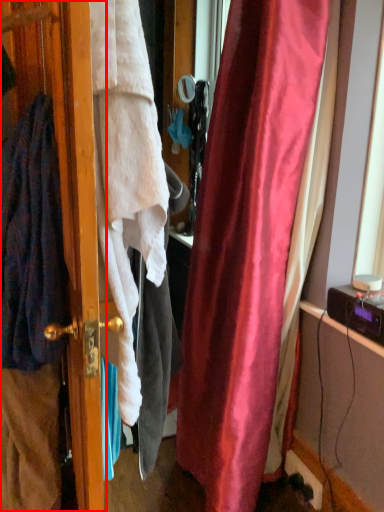
Question: From the image's perspective, what is the correct spatial relationship of screen door (annotated by the red box) in relation to cardigan?

Choices:
 (A) below
 (B) above

Answer: (A)